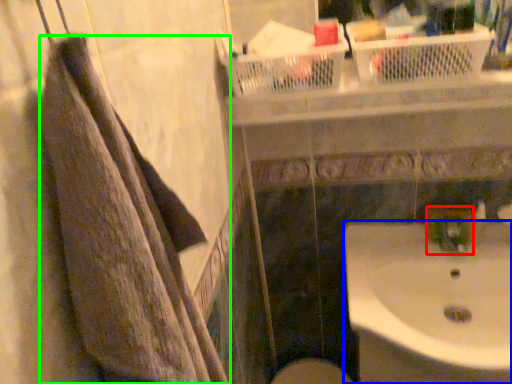
Question: Which object is the closest to the plumbing fixture (highlighted by a red box)? Choose among these: sink (highlighted by a blue box) or towel (highlighted by a green box).

Choices:
 (A) sink
 (B) towel

Answer: (A)